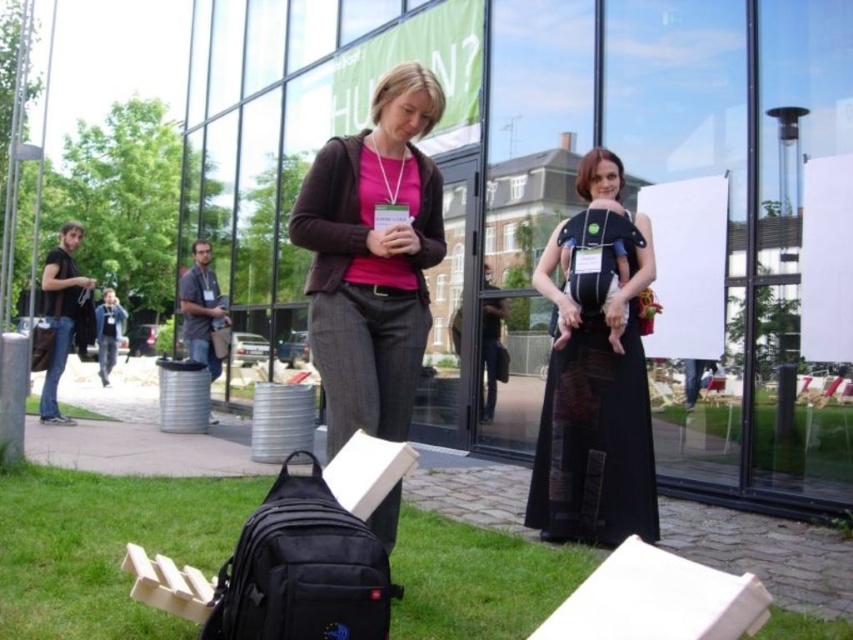
Question: Does black cotton shirt at left have a lesser width compared to light blue denim jacket at left?

Choices:
 (A) no
 (B) yes

Answer: (B)

Question: Can you confirm if green grass at lower left is positioned below black fabric baby carrier at center?

Choices:
 (A) yes
 (B) no

Answer: (A)

Question: Which point is farther from the camera taking this photo?

Choices:
 (A) (299, 230)
 (B) (97, 348)

Answer: (B)

Question: Is black fabric baby carrier at center below light blue denim jacket at left?

Choices:
 (A) yes
 (B) no

Answer: (B)

Question: Estimate the real-world distances between objects in this image. Which object is closer to the matte black jacket at center?

Choices:
 (A) green grass at lower left
 (B) light blue denim jacket at left
 (C) black cotton shirt at left
 (D) black fabric baby carrier at center

Answer: (A)

Question: Which point is closer to the camera taking this photo?

Choices:
 (A) (55, 364)
 (B) (372, 272)
 (C) (4, 595)

Answer: (C)